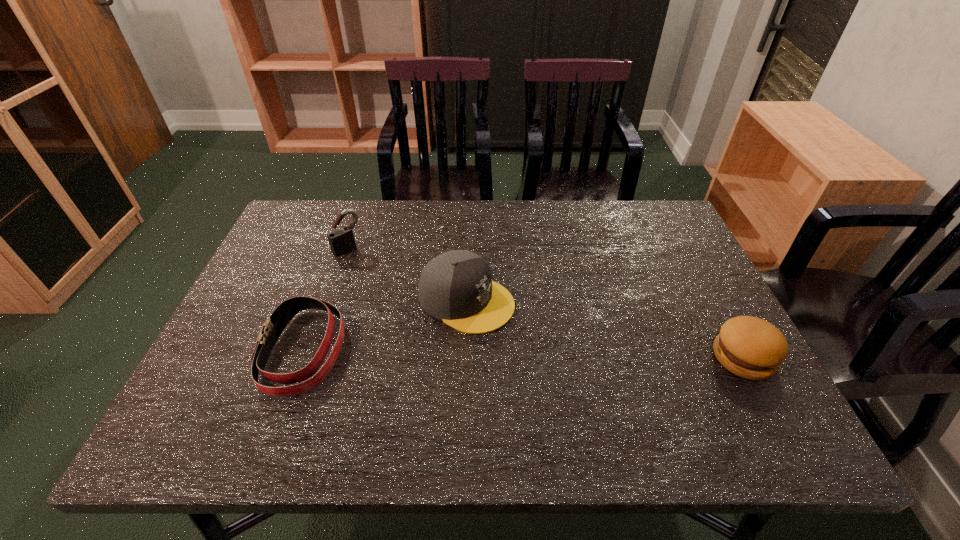
In order to click on empty space that is in between the hamburger and the padlock in this screenshot , I will do `click(545, 303)`.

Find the location of `free space between the dog collar and the second object from right to left`. free space between the dog collar and the second object from right to left is located at coordinates (385, 325).

Identify the location of vacant point located between the hamburger and the dog collar. (523, 354).

What are the coordinates of `free space between the padlock and the second object from right to left` in the screenshot? It's located at tap(407, 274).

Find the location of a particular element. vacant area that lies between the padlock and the rightmost object is located at coordinates (545, 303).

At what (x,y) coordinates should I click in order to perform the action: click on object identified as the second closest to the rightmost object. Please return your answer as a coordinate pair (x, y). This screenshot has width=960, height=540. Looking at the image, I should click on (273, 327).

Select which object is the third closest to the hamburger. Please provide its 2D coordinates. Your answer should be formatted as a tuple, i.e. [(x, y)], where the tuple contains the x and y coordinates of a point satisfying the conditions above.

[(341, 241)]

At what (x,y) coordinates should I click in order to perform the action: click on vacant space that satisfies the following two spatial constraints: 1. on the back side of the dog collar; 2. on the left side of the farthest object. Please return your answer as a coordinate pair (x, y). The height and width of the screenshot is (540, 960). Looking at the image, I should click on (340, 248).

This screenshot has height=540, width=960. In order to click on free space that satisfies the following two spatial constraints: 1. on the back side of the cap; 2. on the left side of the dog collar in this screenshot , I will do `click(322, 300)`.

Where is `vacant space that satisfies the following two spatial constraints: 1. on the front side of the dog collar; 2. on the right side of the hamburger`? The height and width of the screenshot is (540, 960). vacant space that satisfies the following two spatial constraints: 1. on the front side of the dog collar; 2. on the right side of the hamburger is located at coordinates (300, 357).